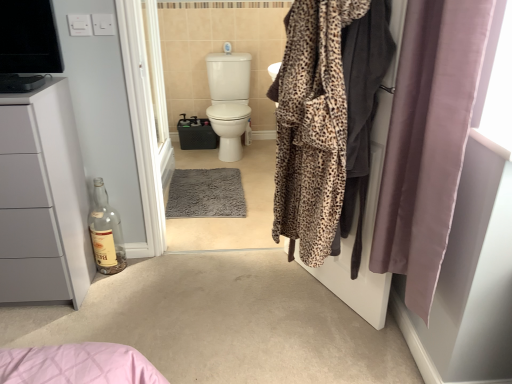
Where is `vacant region below silky mauve curtain at right (from a real-world perspective)`? This screenshot has width=512, height=384. vacant region below silky mauve curtain at right (from a real-world perspective) is located at coordinates (384, 346).